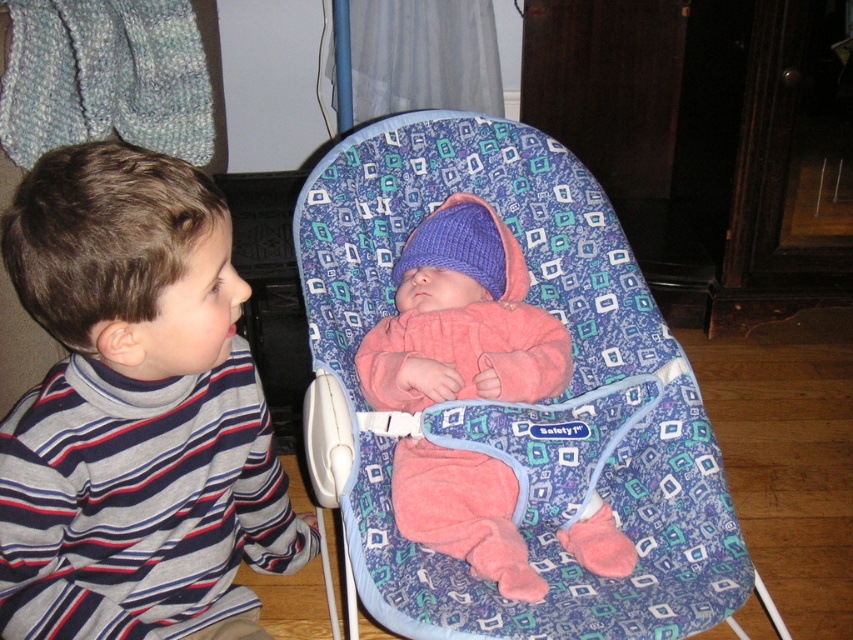
You are a parent trying to dress your child. You have a striped turtleneck shirt at left and a pink fleece baby at center. Which clothing item is bigger in size?

The striped turtleneck shirt at left has a larger size compared to the pink fleece baby at center.

You are standing in the room and see the point at coordinates [611,506]. If you want to throw a ball to that point, will it land there without hitting any objects?

The point at coordinates [611,506] is 1.48 meters away from the viewer, so yes, the ball will land there without hitting any objects as there are no obstacles mentioned in the scene description.

You are a parent trying to choose between placing a baby in either the blue patterned baby carrier at center or the striped turtleneck shirt at left. Based on their sizes, which one can comfortably hold the baby?

The blue patterned baby carrier at center has a larger size compared to the striped turtleneck shirt at left, so it can comfortably hold the baby.